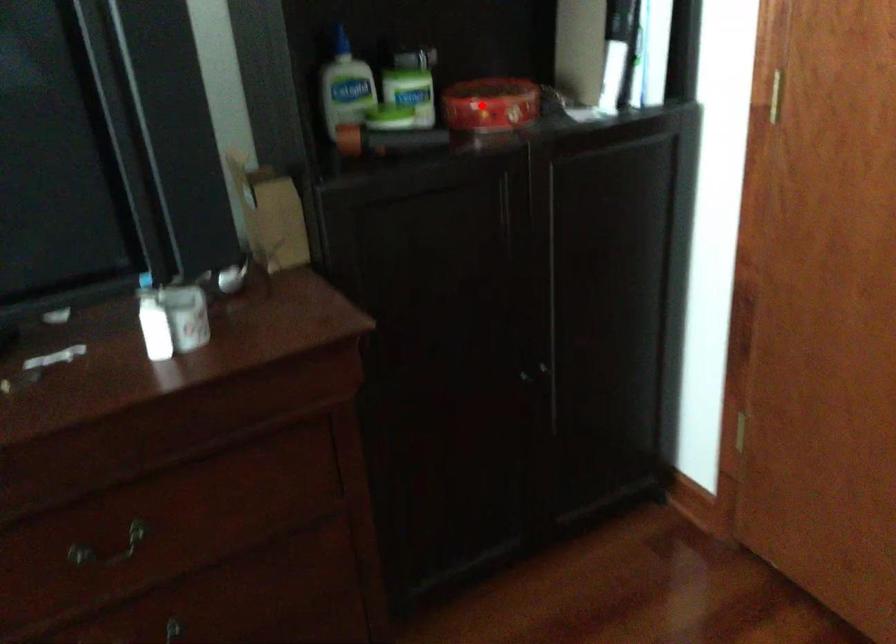
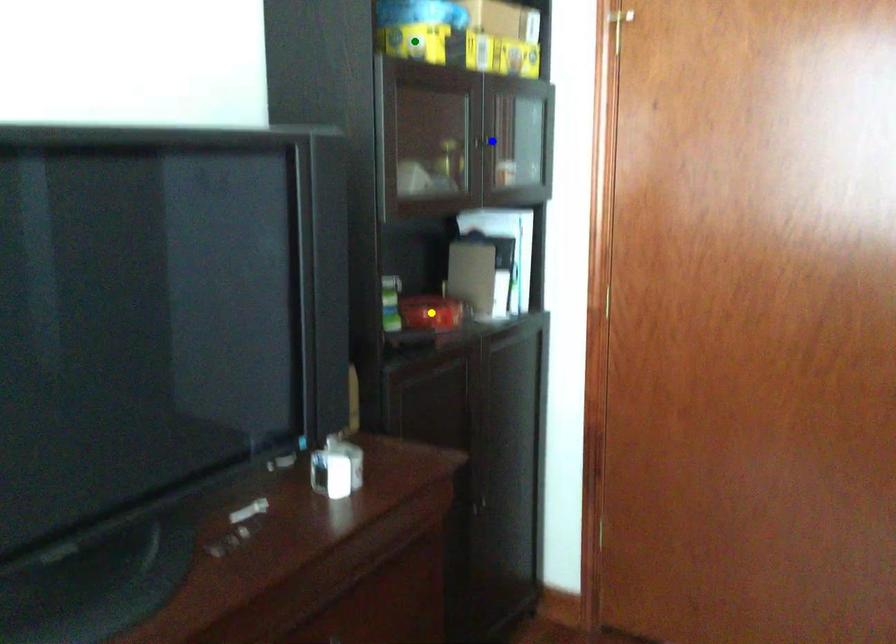
Question: I am providing you with two images of the same scene from different viewpoints. A red point is marked on the first image. You are given multiple points on the second image. Which mark in image 2 goes with the point in image 1?

Choices:
 (A) blue point
 (B) yellow point
 (C) green point

Answer: (B)